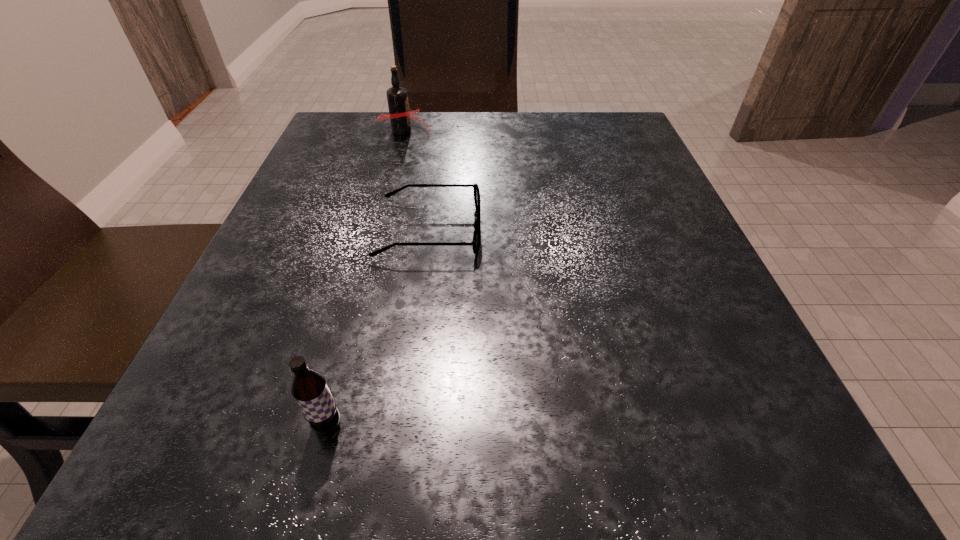
The width and height of the screenshot is (960, 540). What are the coordinates of `object at the far left corner` in the screenshot? It's located at (400, 116).

You are a GUI agent. You are given a task and a screenshot of the screen. Output one action in this format:
    pyautogui.click(x=<x>, y=<y>)
    Task: Click on the object that is at the near left corner
    
    Given the screenshot: What is the action you would take?
    pyautogui.click(x=309, y=388)

The width and height of the screenshot is (960, 540). In order to click on blank space at the far edge of the desktop in this screenshot , I will do `click(460, 126)`.

The image size is (960, 540). Identify the location of vacant space at the near edge of the desktop. [598, 448].

In the image, there is a desktop. Find the location of `vacant region at the left edge`. vacant region at the left edge is located at coordinates (294, 248).

You are a GUI agent. You are given a task and a screenshot of the screen. Output one action in this format:
    pyautogui.click(x=<x>, y=<y>)
    Task: Click on the free spot at the right edge of the desktop
    
    Given the screenshot: What is the action you would take?
    click(588, 187)

The image size is (960, 540). In order to click on vacant space at the far left corner of the desktop in this screenshot , I will do `click(337, 164)`.

This screenshot has height=540, width=960. I want to click on vacant space at the near left corner of the desktop, so click(x=251, y=490).

Image resolution: width=960 pixels, height=540 pixels. Find the location of `vacant region at the far right corner of the desktop`. vacant region at the far right corner of the desktop is located at coordinates click(608, 141).

In the image, there is a desktop. Identify the location of vacant space at the near right corner. Image resolution: width=960 pixels, height=540 pixels. (763, 495).